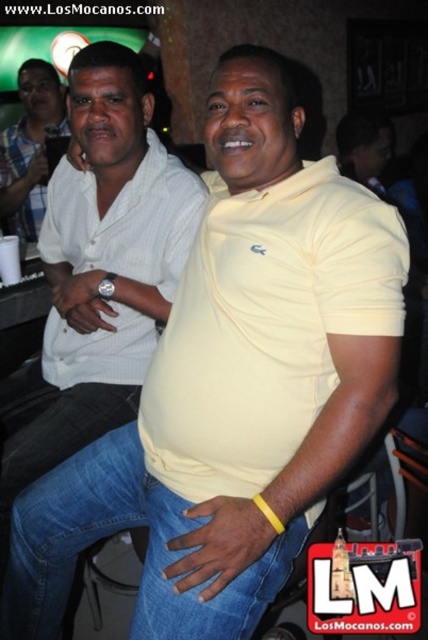
You are a photographer at the event and want to ensure both the white matte shirt at center and the blue denim jeans at center are visible in your photo. Given their sizes, which one might you need to adjust your framing to better accommodate?

The white matte shirt at center is thinner than the blue denim jeans at center, so you might need to adjust your framing to ensure the thinner white matte shirt at center is adequately captured alongside the wider blue denim jeans at center.

From the picture: You are at a social gathering and want to take a photo of the white matte shirt at center. Where should you aim your camera to capture it?

You should aim your camera at point (103, 266) to capture the white matte shirt at center.